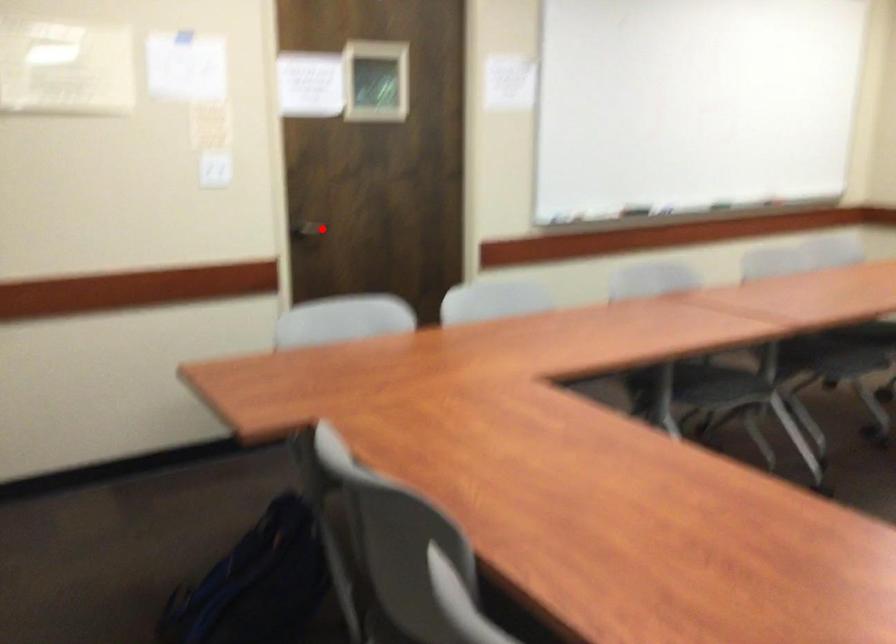
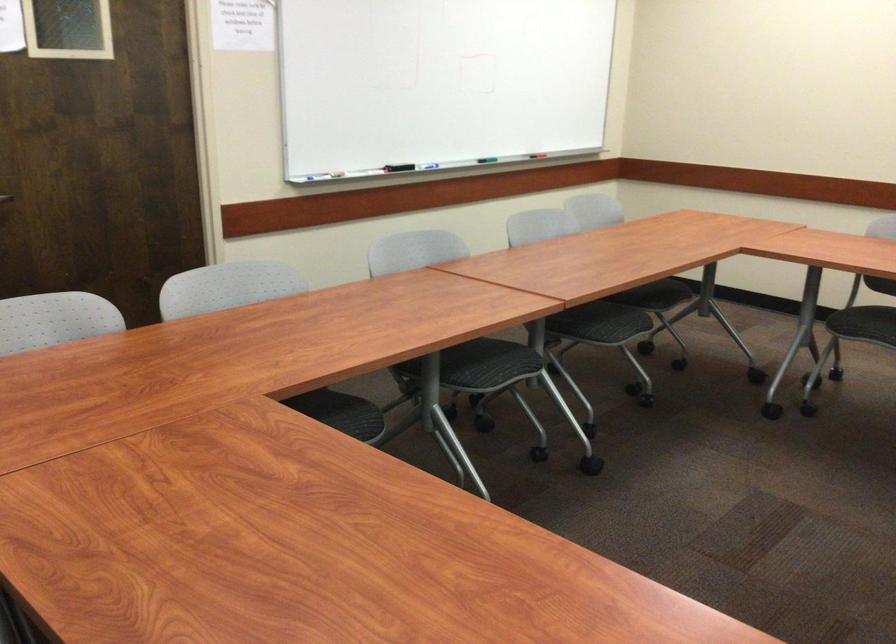
Question: A red point is marked in image1. In image2, is the corresponding 3D point closer to the camera or farther? Reply with the corresponding letter.

Choices:
 (A) The corresponding 3D point is closer.
 (B) The corresponding 3D point is farther.

Answer: (A)